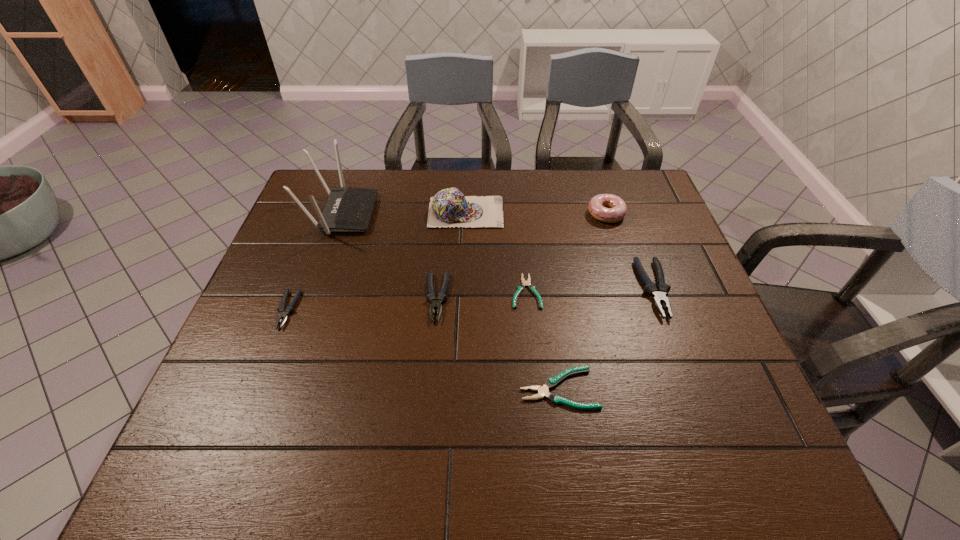
Locate an element on the screen. This screenshot has height=540, width=960. gray pliers that stands as the second closest to the tallest object is located at coordinates (435, 304).

The image size is (960, 540). Identify the location of vacant space that satisfies the following two spatial constraints: 1. at the gripping part of the second shortest pliers; 2. on the left side of the second gray pliers from left to right. click(429, 388).

Image resolution: width=960 pixels, height=540 pixels. Find the location of `vacant space that satisfies the following two spatial constraints: 1. on the front-facing side of the router; 2. on the right side of the sixth shortest object`. vacant space that satisfies the following two spatial constraints: 1. on the front-facing side of the router; 2. on the right side of the sixth shortest object is located at coordinates (342, 214).

Locate an element on the screen. vacant position in the image that satisfies the following two spatial constraints: 1. at the gripping part of the leftmost gray pliers; 2. on the left side of the nearer teal pliers is located at coordinates (256, 388).